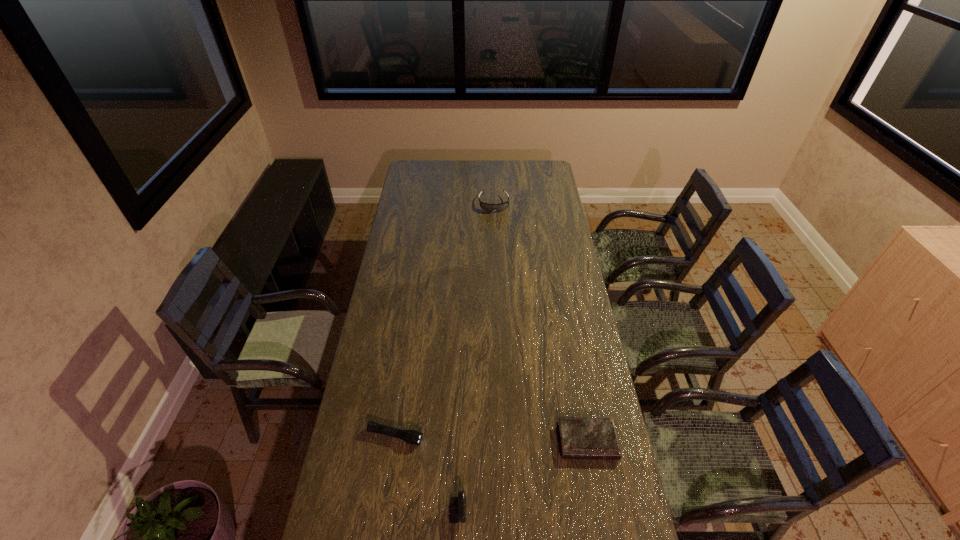
Locate an element on the screen. unoccupied area between the flashlight and the nearest object is located at coordinates (410, 476).

Image resolution: width=960 pixels, height=540 pixels. In order to click on vacant space that's between the flashlight and the third object from left to right in this screenshot , I will do `click(444, 320)`.

Identify the location of free area in between the diary and the goggles. (540, 322).

Where is `vacant area that lies between the diary and the webcam`? Image resolution: width=960 pixels, height=540 pixels. vacant area that lies between the diary and the webcam is located at coordinates (506, 478).

Select which object is the second closest to the diary. Please provide its 2D coordinates. Your answer should be formatted as a tuple, i.e. [(x, y)], where the tuple contains the x and y coordinates of a point satisfying the conditions above.

[(412, 437)]

The width and height of the screenshot is (960, 540). In order to click on the closest object to the farthest object in this screenshot , I will do `click(580, 438)`.

Find the location of `free space that satisfies the following two spatial constraints: 1. on the front side of the flashlight; 2. on the front-facing side of the nearest object`. free space that satisfies the following two spatial constraints: 1. on the front side of the flashlight; 2. on the front-facing side of the nearest object is located at coordinates (384, 516).